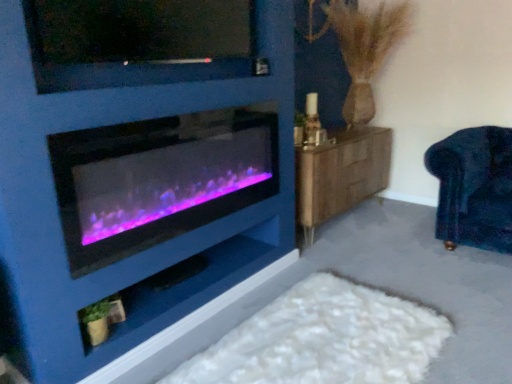
Question: Can you confirm if matte black tv at upper center is positioned to the right of matte black shelf at lower center?

Choices:
 (A) yes
 (B) no

Answer: (A)

Question: Is matte black tv at upper center thinner than matte black shelf at lower center?

Choices:
 (A) no
 (B) yes

Answer: (B)

Question: From the image's perspective, is matte black tv at upper center beneath matte black shelf at lower center?

Choices:
 (A) yes
 (B) no

Answer: (B)

Question: Considering the relative sizes of matte black tv at upper center and matte black shelf at lower center in the image provided, is matte black tv at upper center bigger than matte black shelf at lower center?

Choices:
 (A) yes
 (B) no

Answer: (A)

Question: Is matte black tv at upper center turned away from matte black shelf at lower center?

Choices:
 (A) yes
 (B) no

Answer: (B)

Question: From a real-world perspective, is matte black tv at upper center located beneath matte black shelf at lower center?

Choices:
 (A) no
 (B) yes

Answer: (A)

Question: Can you confirm if matte black tv at upper center is bigger than velvet dark blue armchair at right?

Choices:
 (A) no
 (B) yes

Answer: (A)

Question: Is matte black tv at upper center beside velvet dark blue armchair at right?

Choices:
 (A) yes
 (B) no

Answer: (B)

Question: Can you confirm if matte black tv at upper center is thinner than velvet dark blue armchair at right?

Choices:
 (A) yes
 (B) no

Answer: (A)

Question: Can you confirm if matte black tv at upper center is wider than velvet dark blue armchair at right?

Choices:
 (A) no
 (B) yes

Answer: (A)

Question: Is matte black tv at upper center facing away from velvet dark blue armchair at right?

Choices:
 (A) yes
 (B) no

Answer: (B)

Question: Is matte black tv at upper center shorter than velvet dark blue armchair at right?

Choices:
 (A) yes
 (B) no

Answer: (A)

Question: Considering the relative sizes of purple-lit glass wood burning stove at left and matte black shelf at lower center in the image provided, is purple-lit glass wood burning stove at left thinner than matte black shelf at lower center?

Choices:
 (A) yes
 (B) no

Answer: (A)